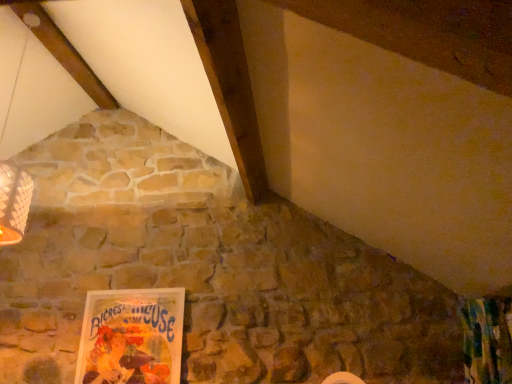
Question: In terms of width, does matte paper poster at lower left look wider or thinner when compared to textured green curtain at lower right?

Choices:
 (A) wide
 (B) thin

Answer: (B)

Question: From a real-world perspective, is matte paper poster at lower left positioned above or below textured green curtain at lower right?

Choices:
 (A) above
 (B) below

Answer: (A)

Question: Would you say matte paper poster at lower left is to the left or to the right of textured green curtain at lower right in the picture?

Choices:
 (A) right
 (B) left

Answer: (B)

Question: From the image's perspective, relative to matte paper poster at lower left, is textured green curtain at lower right above or below?

Choices:
 (A) below
 (B) above

Answer: (B)

Question: Is textured green curtain at lower right spatially inside matte paper poster at lower left, or outside of it?

Choices:
 (A) outside
 (B) inside

Answer: (A)

Question: From a real-world perspective, is textured green curtain at lower right positioned above or below matte paper poster at lower left?

Choices:
 (A) below
 (B) above

Answer: (A)

Question: Based on their positions, is textured green curtain at lower right located to the left or right of matte paper poster at lower left?

Choices:
 (A) left
 (B) right

Answer: (B)